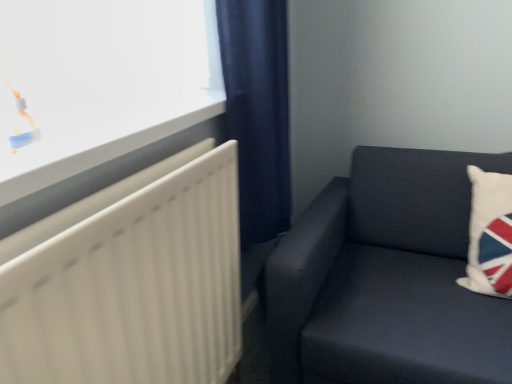
Question: Does white matte radiator at left come in front of white fabric pillow at right?

Choices:
 (A) no
 (B) yes

Answer: (B)

Question: Is white matte radiator at left in contact with white fabric pillow at right?

Choices:
 (A) yes
 (B) no

Answer: (B)

Question: From the image's perspective, would you say white matte radiator at left is shown under white fabric pillow at right?

Choices:
 (A) yes
 (B) no

Answer: (A)

Question: Are white matte radiator at left and white fabric pillow at right located far from each other?

Choices:
 (A) yes
 (B) no

Answer: (B)

Question: Is white matte radiator at left smaller than white fabric pillow at right?

Choices:
 (A) yes
 (B) no

Answer: (B)

Question: Can you confirm if white matte radiator at left is bigger than white fabric pillow at right?

Choices:
 (A) no
 (B) yes

Answer: (B)

Question: From a real-world perspective, is navy blue fabric curtain at center beneath white matte radiator at left?

Choices:
 (A) no
 (B) yes

Answer: (A)

Question: Does navy blue fabric curtain at center have a larger size compared to white matte radiator at left?

Choices:
 (A) yes
 (B) no

Answer: (B)

Question: Does navy blue fabric curtain at center have a greater width compared to white matte radiator at left?

Choices:
 (A) yes
 (B) no

Answer: (B)

Question: Is white matte radiator at left surrounded by navy blue fabric curtain at center?

Choices:
 (A) no
 (B) yes

Answer: (A)

Question: From a real-world perspective, is navy blue fabric curtain at center physically above white matte radiator at left?

Choices:
 (A) yes
 (B) no

Answer: (A)

Question: Is navy blue fabric curtain at center oriented towards white matte radiator at left?

Choices:
 (A) no
 (B) yes

Answer: (A)

Question: From the image's perspective, is white glossy window at upper left on white fabric pillow at right?

Choices:
 (A) no
 (B) yes

Answer: (B)